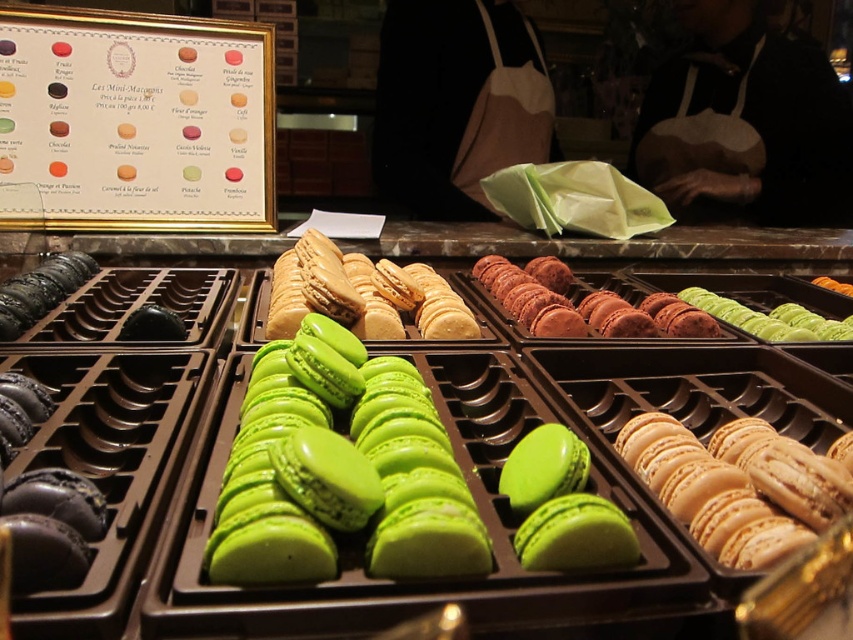
How distant is green glossy macarons at center from matte beige macarons at center right?

green glossy macarons at center is 12.87 inches away from matte beige macarons at center right.

Is point (300, 408) positioned behind point (798, 456)?

Yes, point (300, 408) is behind point (798, 456).

Identify the location of green glossy macarons at center. Image resolution: width=853 pixels, height=640 pixels. (306, 458).